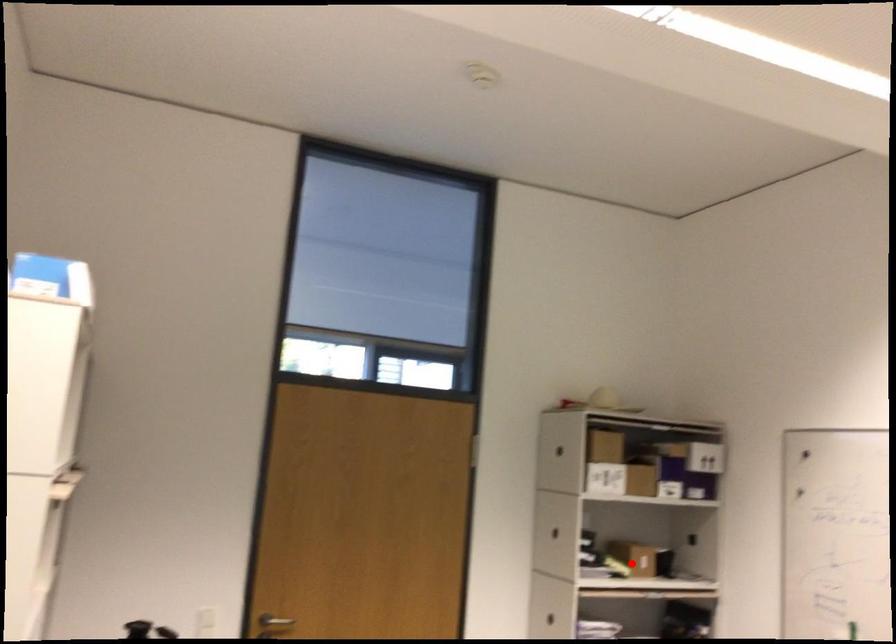
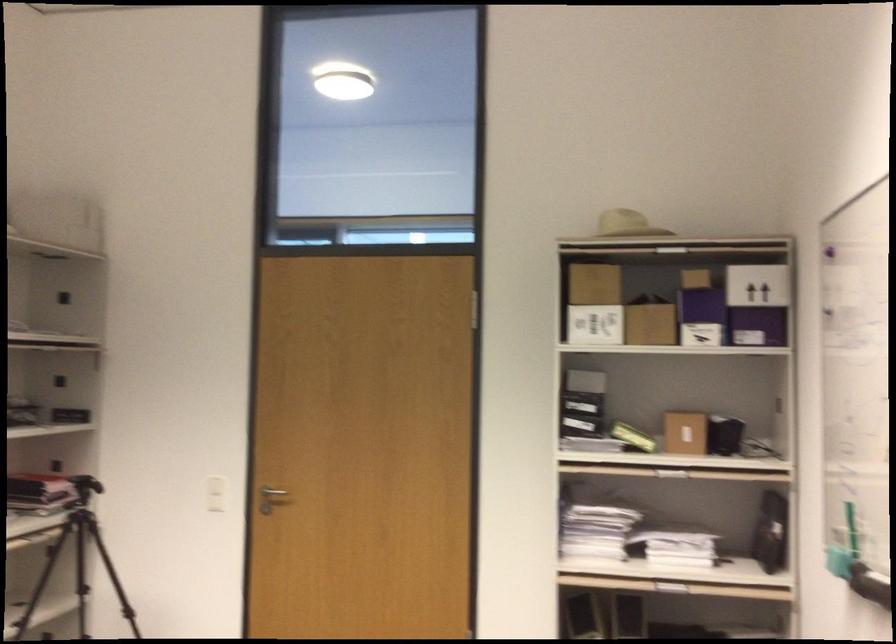
The point at the highlighted location is marked in the first image. Where is the corresponding point in the second image?

(684, 431)